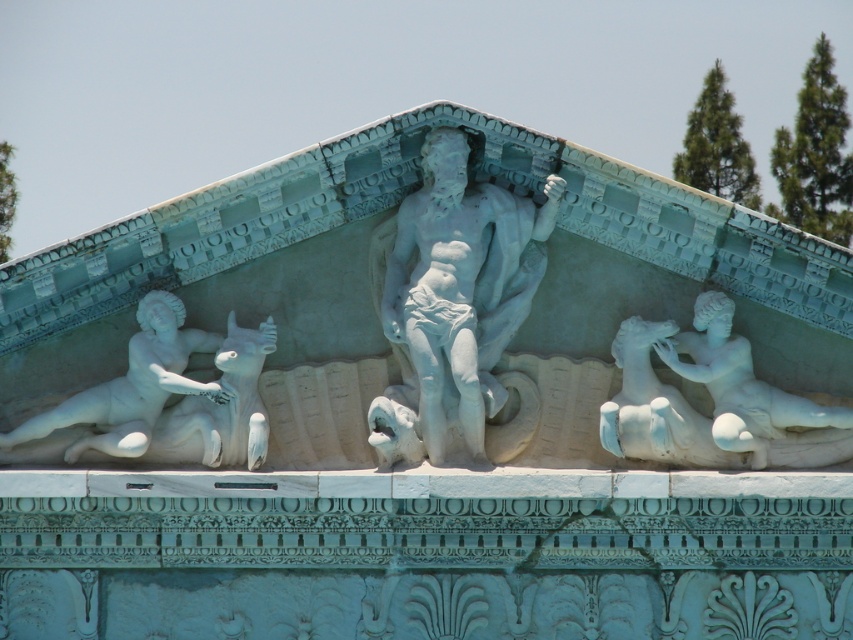
You are an architect analyzing the spatial arrangement of the classical pediment. You have two points marked on the image at coordinates point [532,237] and point [251,362]. Which point is located further away from the viewer?

Point [532,237] is behind point [251,362], so it is further away from the viewer.

Based on the provided scene description, where is the white marble statue at center located in terms of coordinates?

The white marble statue at center is located at point coordinates of (451, 300).